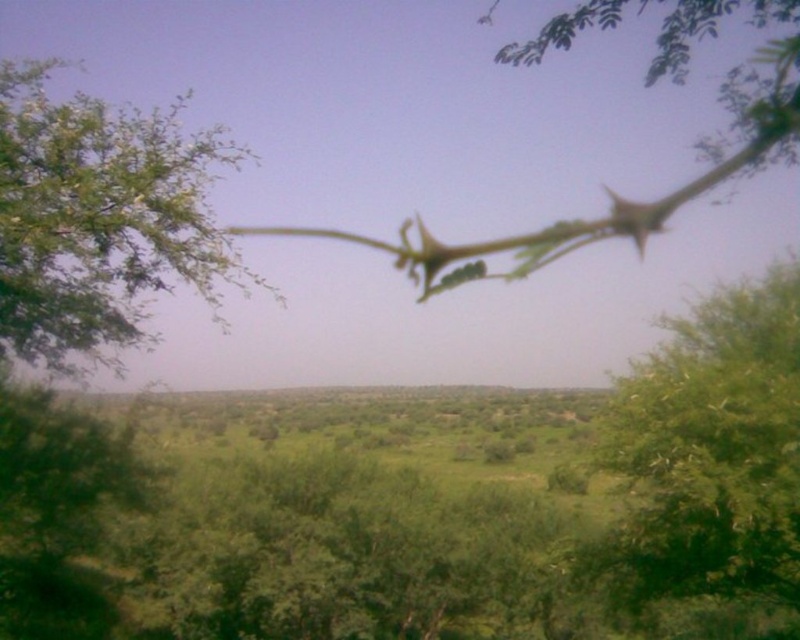
Which is behind, point (658, 472) or point (22, 236)?

Point (658, 472)

Is green leafy tree at center to the right of green leafy tree at upper left from the viewer's perspective?

Yes, green leafy tree at center is to the right of green leafy tree at upper left.

Is point (745, 396) behind point (24, 257)?

That is True.

Where is `green leafy tree at center`? Image resolution: width=800 pixels, height=640 pixels. green leafy tree at center is located at coordinates (708, 456).